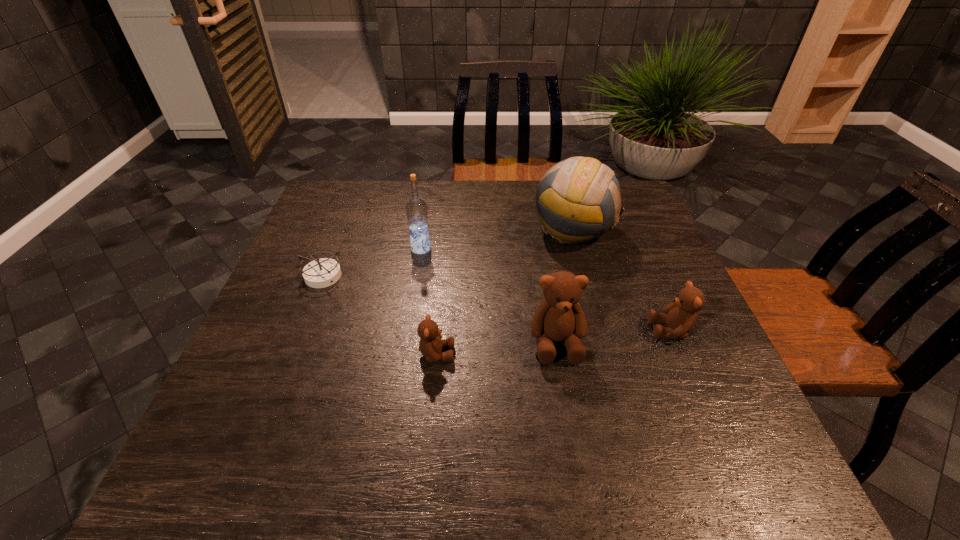
Image resolution: width=960 pixels, height=540 pixels. Find the location of `free space between the second tallest teddy bear and the third farthest object`. free space between the second tallest teddy bear and the third farthest object is located at coordinates pos(497,303).

You are a GUI agent. You are given a task and a screenshot of the screen. Output one action in this format:
    pyautogui.click(x=<x>, y=<y>)
    Task: Click on the free point between the fourth nearest object and the fourth object from right to left
    Image resolution: width=960 pixels, height=540 pixels.
    Given the screenshot: What is the action you would take?
    pyautogui.click(x=380, y=315)

I want to click on free space between the vodka and the leftmost object, so click(372, 262).

Image resolution: width=960 pixels, height=540 pixels. Find the location of `free space between the leftmost teddy bear and the fifth object from right to left`. free space between the leftmost teddy bear and the fifth object from right to left is located at coordinates (429, 301).

Image resolution: width=960 pixels, height=540 pixels. Identify the location of vacant space that is in between the shortest teddy bear and the volleyball. (505, 292).

Where is `free space between the second tallest teddy bear and the tallest teddy bear`? free space between the second tallest teddy bear and the tallest teddy bear is located at coordinates (613, 336).

Locate an element on the screen. free spot between the vodka and the leftmost teddy bear is located at coordinates (429, 301).

Where is `vacant point located between the leftmost object and the fifth tallest object`? vacant point located between the leftmost object and the fifth tallest object is located at coordinates (380, 315).

At what (x,y) coordinates should I click in order to perform the action: click on object that stands as the fourth closest to the fourth tallest object. Please return your answer as a coordinate pair (x, y). This screenshot has height=540, width=960. Looking at the image, I should click on (416, 208).

This screenshot has width=960, height=540. Identify the location of object that can be found as the fifth closest to the second object from left to right. (680, 317).